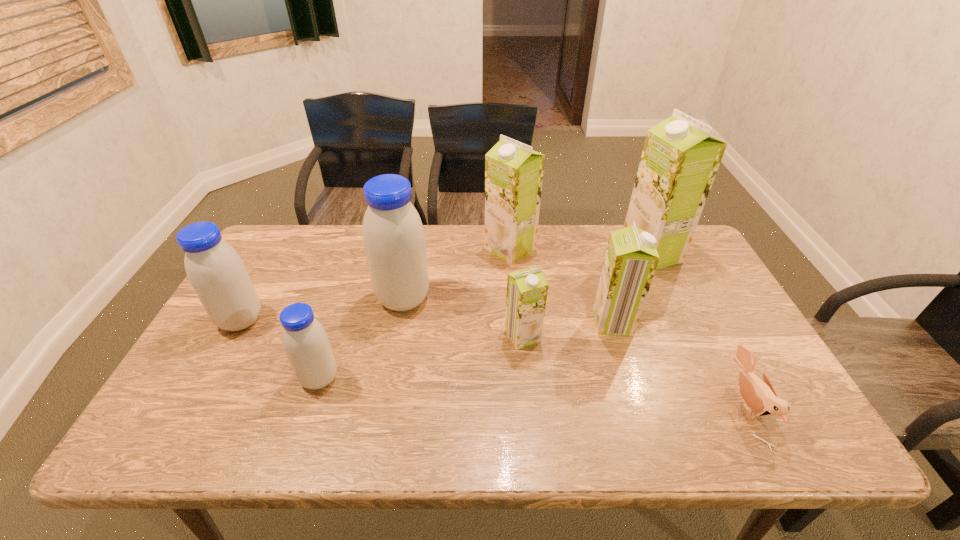
I want to click on the biggest green soya milk, so click(x=680, y=158).

I want to click on the rightmost soya milk, so click(680, 158).

Identify the location of the fifth soya milk from right to left. (393, 235).

This screenshot has height=540, width=960. I want to click on the rightmost blue soya milk, so click(x=393, y=235).

Find the location of a particular element. Image resolution: width=960 pixels, height=540 pixels. the second biggest green soya milk is located at coordinates (513, 171).

Locate an element on the screen. The height and width of the screenshot is (540, 960). the sixth object from left to right is located at coordinates (631, 258).

What are the coordinates of `the third green soya milk from left to right` in the screenshot? It's located at (631, 258).

This screenshot has height=540, width=960. I want to click on the leftmost blue soya milk, so click(x=215, y=270).

This screenshot has width=960, height=540. What are the coordinates of `the leftmost object` in the screenshot? It's located at (215, 270).

This screenshot has height=540, width=960. Find the location of `the second object from left to right`. the second object from left to right is located at coordinates (305, 341).